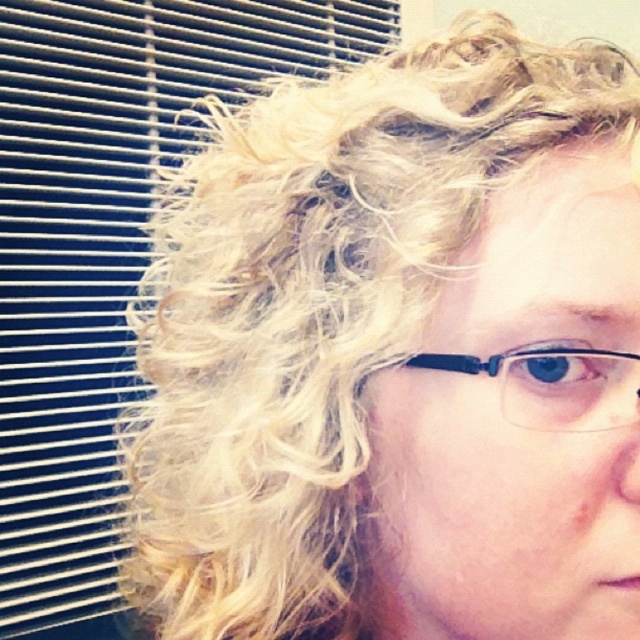
Does matte plastic hair at upper right have a larger size compared to clear plastic glasses at center?

Correct, matte plastic hair at upper right is larger in size than clear plastic glasses at center.

Is matte plastic hair at upper right further to camera compared to clear plastic glasses at center?

That is True.

Identify the location of matte plastic hair at upper right. Image resolution: width=640 pixels, height=640 pixels. (104, 250).

The width and height of the screenshot is (640, 640). I want to click on matte plastic hair at upper right, so click(104, 250).